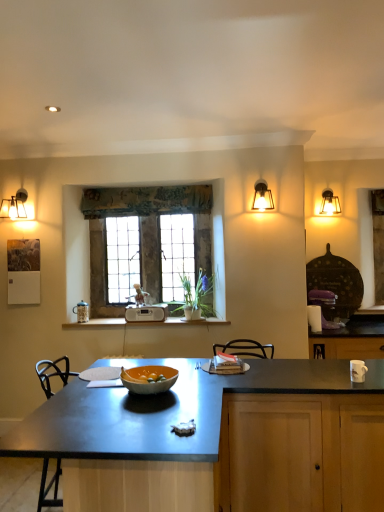
The width and height of the screenshot is (384, 512). What are the coordinates of `unoccupied area in front of orange matte glass bowl at center` in the screenshot? It's located at (151, 413).